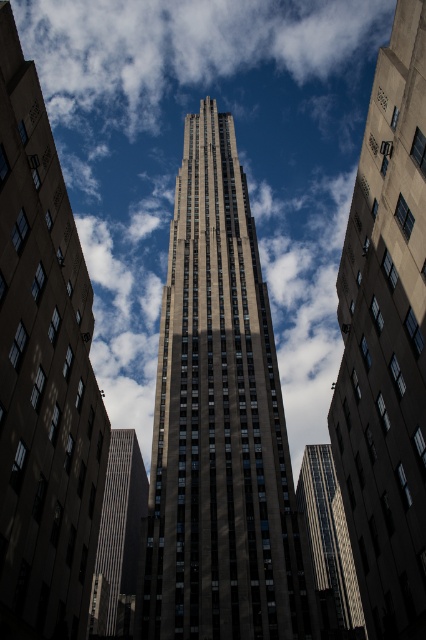
Question: Which object is closer to the camera taking this photo?

Choices:
 (A) reflective glass skyscraper at center
 (B) gray concrete building at lower left
 (C) white fluffy cloud at center
 (D) dark gray stone tower at center

Answer: (D)

Question: Is brown stone skyscraper at center wider than reflective glass skyscraper at center?

Choices:
 (A) yes
 (B) no

Answer: (B)

Question: Does brown stone skyscraper at center appear under reflective glass skyscraper at center?

Choices:
 (A) yes
 (B) no

Answer: (B)

Question: Which point is closer to the camera taking this photo?

Choices:
 (A) (342, 490)
 (B) (327, 572)
 (C) (100, 298)

Answer: (A)

Question: Among these objects, which one is farthest from the camera?

Choices:
 (A) brown stone skyscraper at center
 (B) reflective glass skyscraper at center
 (C) dark gray stone tower at center
 (D) white fluffy cloud at center

Answer: (D)

Question: Can you confirm if dark gray stone tower at center is positioned to the left of brown stone skyscraper at center?

Choices:
 (A) yes
 (B) no

Answer: (A)